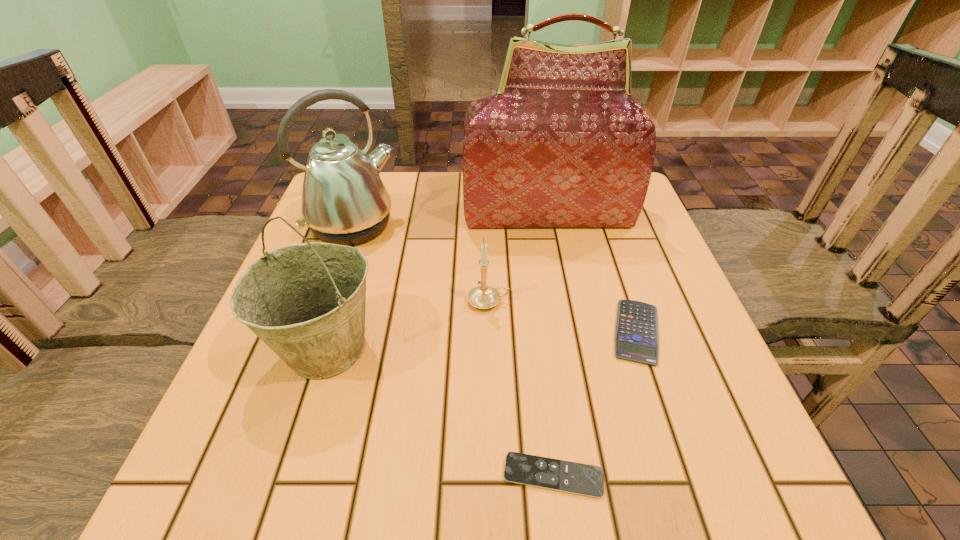
Where is `free region that satisfies the following two spatial constraints: 1. on the front-facing side of the handbag; 2. on the handle side of the fourth tallest object`? Image resolution: width=960 pixels, height=540 pixels. free region that satisfies the following two spatial constraints: 1. on the front-facing side of the handbag; 2. on the handle side of the fourth tallest object is located at coordinates (564, 301).

The image size is (960, 540). In order to click on vacant space that satisfies the following two spatial constraints: 1. on the front-facing side of the handbag; 2. on the handle side of the candle holder in this screenshot , I will do `click(564, 301)`.